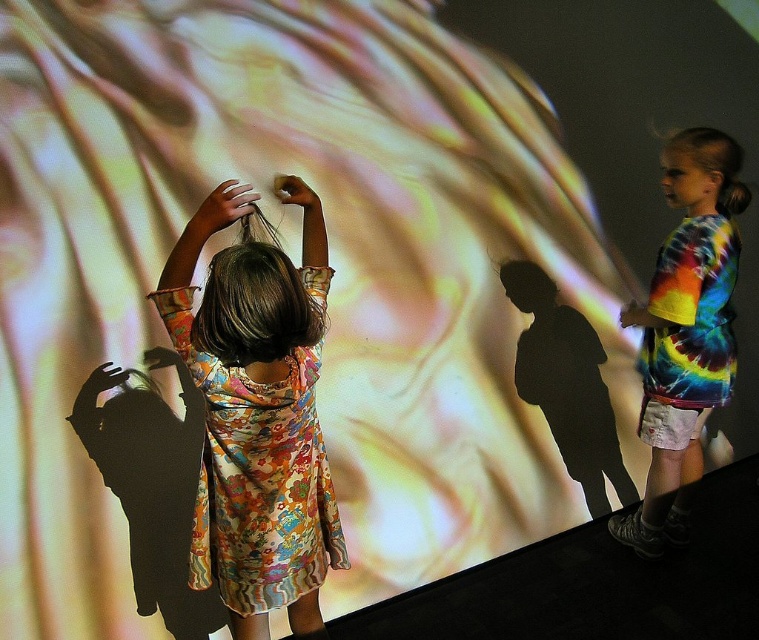
Question: Is floral dress at center thinner than matte black hand at upper right?

Choices:
 (A) yes
 (B) no

Answer: (B)

Question: Does floral dress at center appear on the left side of light brown hair at center?

Choices:
 (A) yes
 (B) no

Answer: (B)

Question: Which object appears farthest from the camera in this image?

Choices:
 (A) tie-dye fabric shirt at right
 (B) matte black hand at upper right

Answer: (B)

Question: Can you confirm if floral dress at center is smaller than light brown hair at center?

Choices:
 (A) yes
 (B) no

Answer: (B)

Question: Which of the following is the closest to the observer?

Choices:
 (A) (194, 243)
 (B) (660, 547)
 (C) (301, 189)
 (D) (254, 568)

Answer: (A)

Question: Estimate the real-world distances between objects in this image. Which object is farther from the matte black hand at upper right?

Choices:
 (A) floral dress at center
 (B) light brown hair at center

Answer: (B)